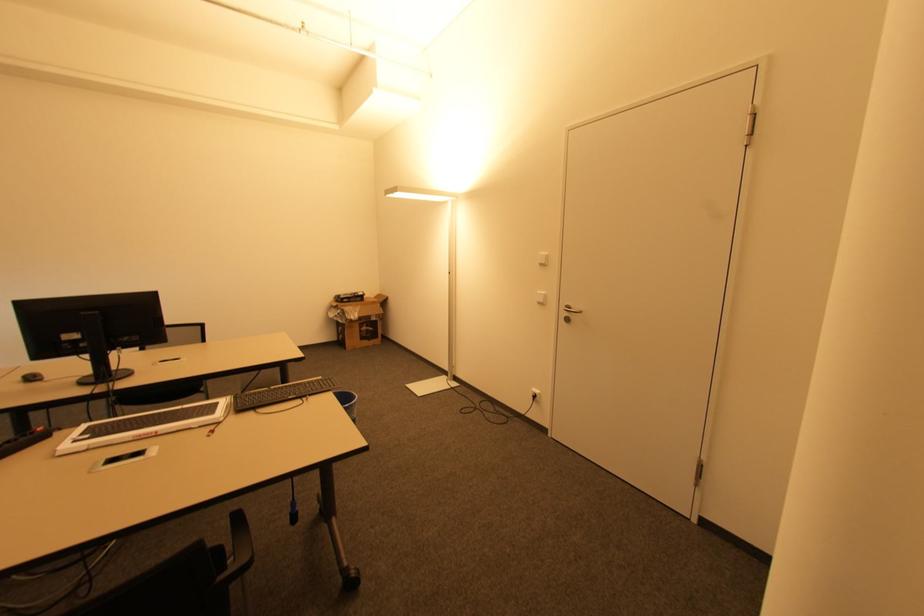
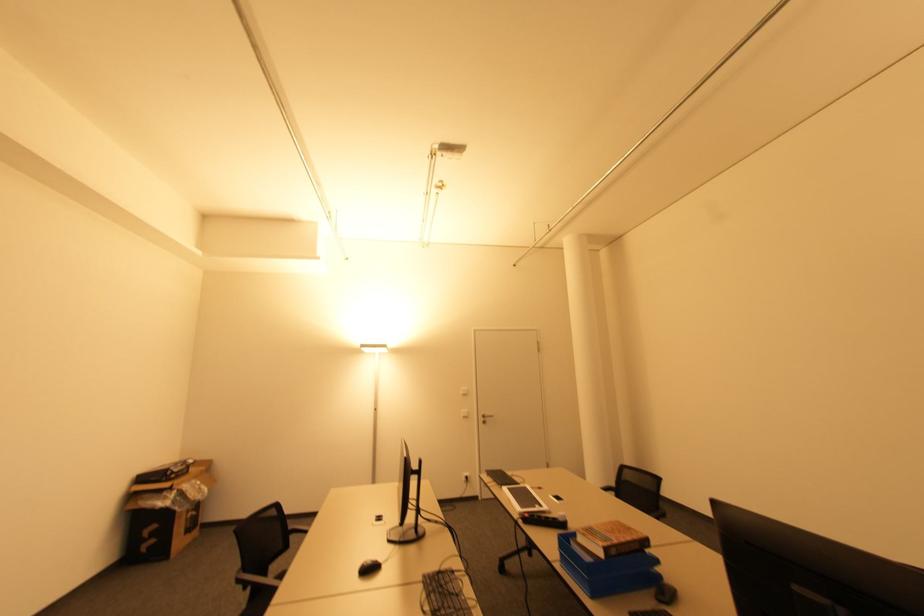
In the second image, find the point that corresponds to point 545,262 in the first image.

(468, 392)